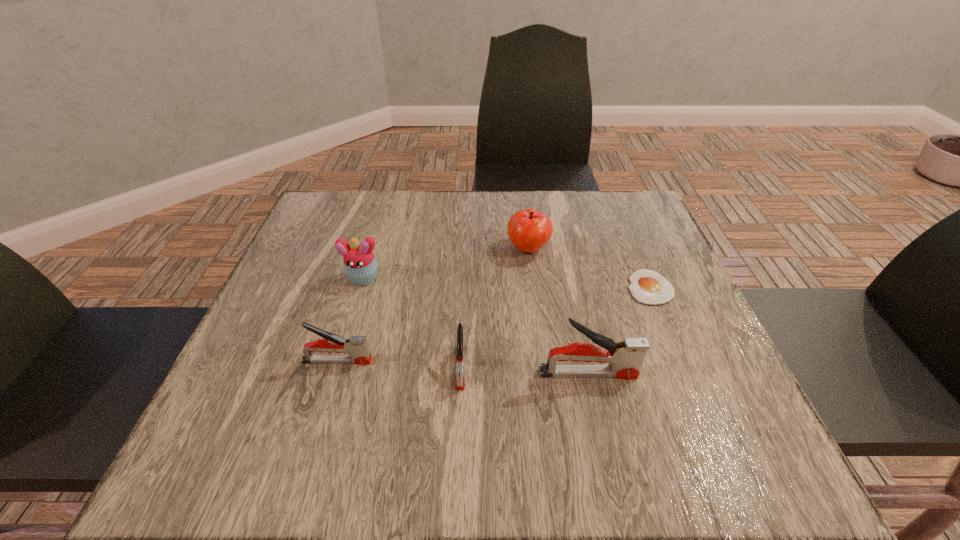
The image size is (960, 540). Find the location of `free space between the leftmost stapler and the cupcake`. free space between the leftmost stapler and the cupcake is located at coordinates (350, 320).

Identify the location of free spot between the apple and the rightmost object. Image resolution: width=960 pixels, height=540 pixels. (589, 268).

Where is `free space that is in between the farthest object and the second tallest stapler`? The image size is (960, 540). free space that is in between the farthest object and the second tallest stapler is located at coordinates (433, 305).

Identify the location of free space between the shortest stapler and the farthest object. (494, 308).

Where is `object that stands as the third closest to the fifth tallest object`? This screenshot has width=960, height=540. object that stands as the third closest to the fifth tallest object is located at coordinates (360, 266).

The height and width of the screenshot is (540, 960). Find the location of `the fourth closest object to the cupcake`. the fourth closest object to the cupcake is located at coordinates (626, 356).

This screenshot has height=540, width=960. Identify the location of stapler that is the second closest to the third object from left to right. (357, 347).

Point out which stapler is positioned as the nearest to the shortest stapler. Please provide its 2D coordinates. Your answer should be formatted as a tuple, i.e. [(x, y)], where the tuple contains the x and y coordinates of a point satisfying the conditions above.

[(626, 356)]

The image size is (960, 540). Identify the location of vacant area in the image that satisfies the following two spatial constraints: 1. on the face of the cupcake; 2. on the handle side of the second tallest stapler. (339, 361).

The width and height of the screenshot is (960, 540). In order to click on vacant space that satisfies the following two spatial constraints: 1. on the face of the cupcake; 2. on the handle side of the leftmost stapler in this screenshot , I will do (339, 361).